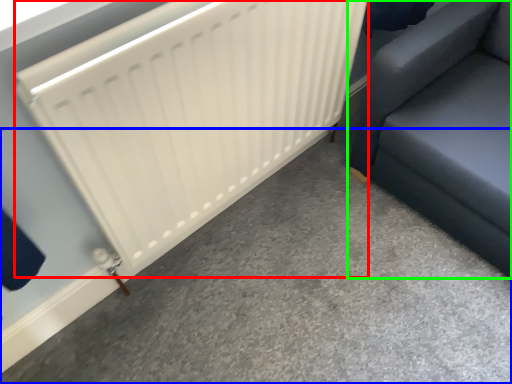
Question: Considering the real-world distances, which object is farthest from radiator (highlighted by a red box)? concrete (highlighted by a blue box) or furniture (highlighted by a green box)?

Choices:
 (A) concrete
 (B) furniture

Answer: (A)